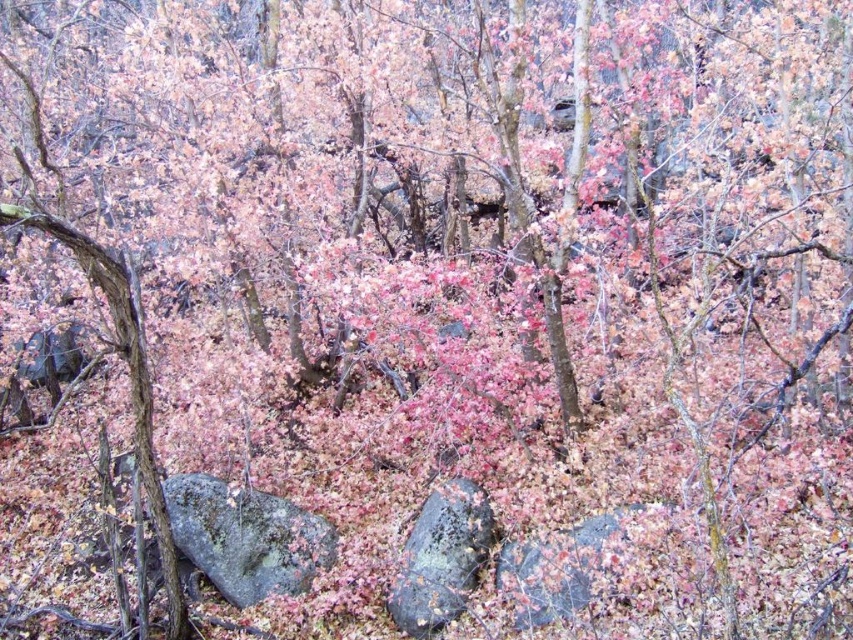
Does gray rough rock at lower left appear on the left side of gray/mossy rock at center?

Indeed, gray rough rock at lower left is positioned on the left side of gray/mossy rock at center.

Does gray rough rock at lower left appear under gray/mossy rock at center?

Indeed, gray rough rock at lower left is positioned under gray/mossy rock at center.

The height and width of the screenshot is (640, 853). I want to click on gray rough rock at lower left, so click(x=247, y=538).

The height and width of the screenshot is (640, 853). I want to click on gray rough rock at lower left, so click(x=247, y=538).

Does gray rough rock at lower left have a smaller size compared to rusty metallic rock at center?

No.

Does gray rough rock at lower left have a lesser height compared to rusty metallic rock at center?

Yes, gray rough rock at lower left is shorter than rusty metallic rock at center.

Is point (222, 522) farther from viewer compared to point (480, 524)?

Yes, point (222, 522) is farther from viewer.

You are a GUI agent. You are given a task and a screenshot of the screen. Output one action in this format:
    pyautogui.click(x=<x>, y=<y>)
    Task: Click on the gray rough rock at lower left
    
    Given the screenshot: What is the action you would take?
    pyautogui.click(x=247, y=538)

Does point (440, 547) lie behind point (512, 560)?

Yes, it is behind point (512, 560).

The image size is (853, 640). I want to click on rusty metallic rock at center, so click(440, 557).

You are a GUI agent. You are given a task and a screenshot of the screen. Output one action in this format:
    pyautogui.click(x=<x>, y=<y>)
    Task: Click on the rusty metallic rock at center
    This screenshot has height=640, width=853.
    Given the screenshot: What is the action you would take?
    pyautogui.click(x=440, y=557)